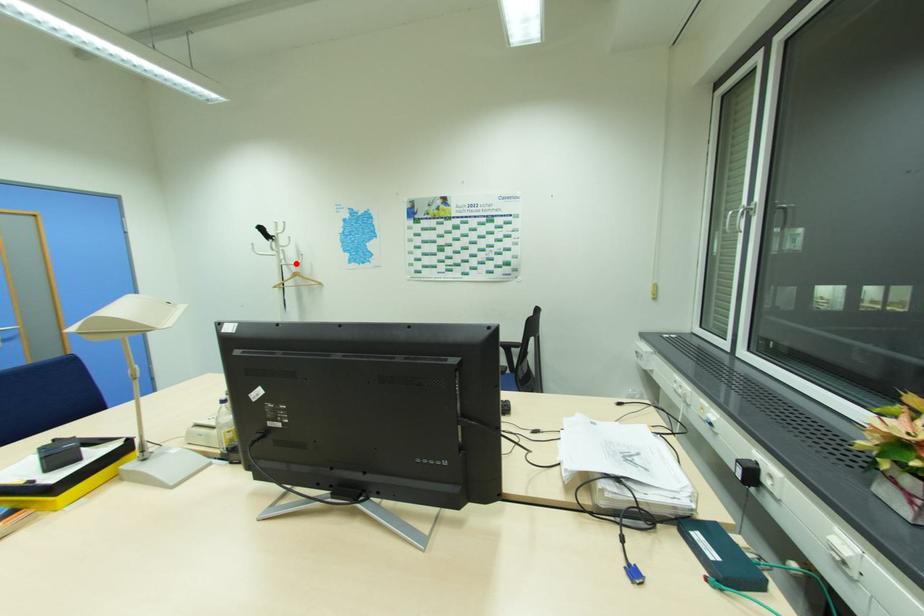
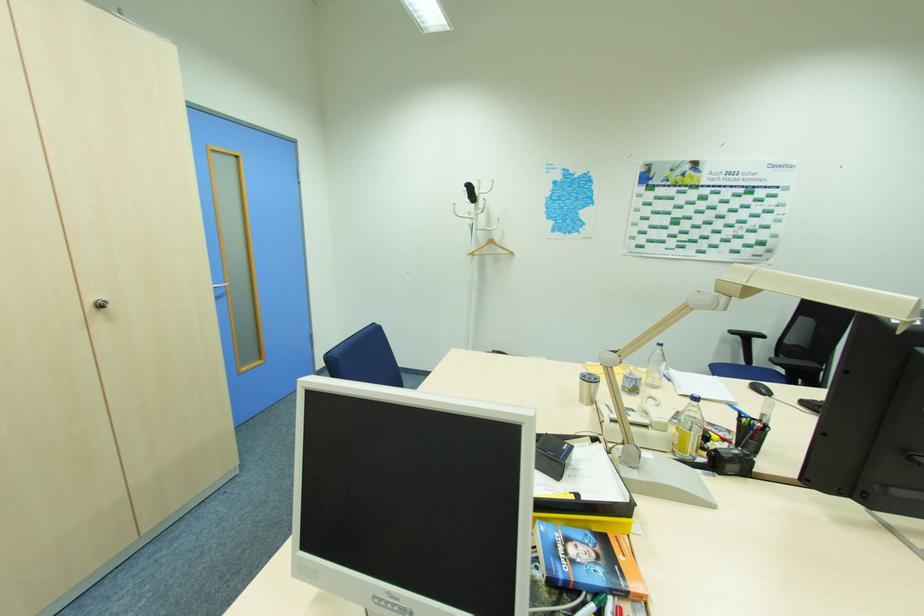
In the second image, find the point that corresponds to the highlighted location in the first image.

(492, 229)